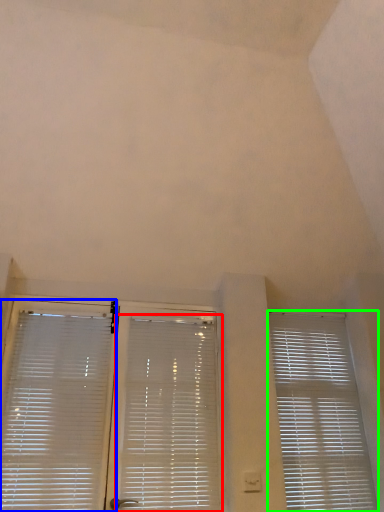
Question: Estimate the real-world distances between objects in this image. Which object is farther from window blind (highlighted by a red box), window blind (highlighted by a blue box) or window blind (highlighted by a green box)?

Choices:
 (A) window blind
 (B) window blind

Answer: (B)